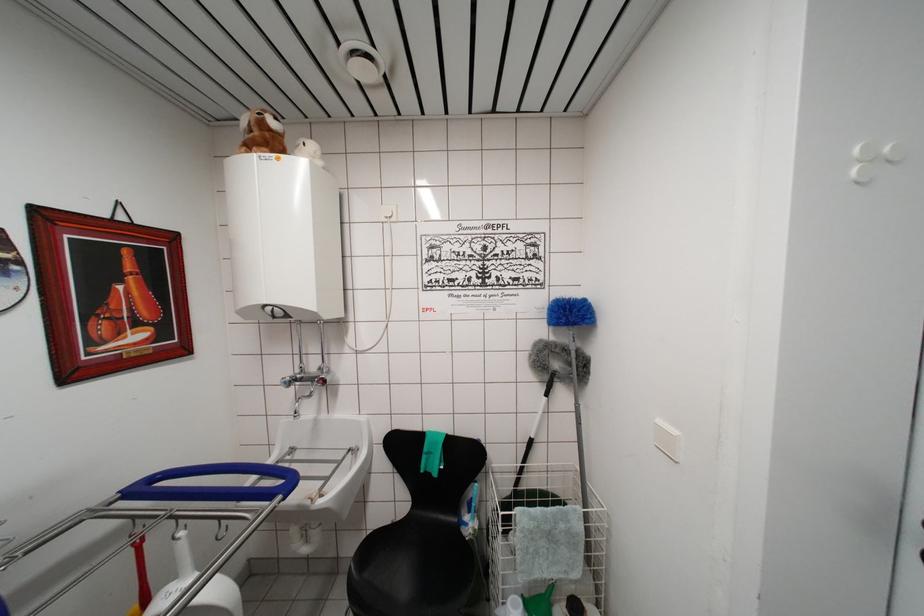
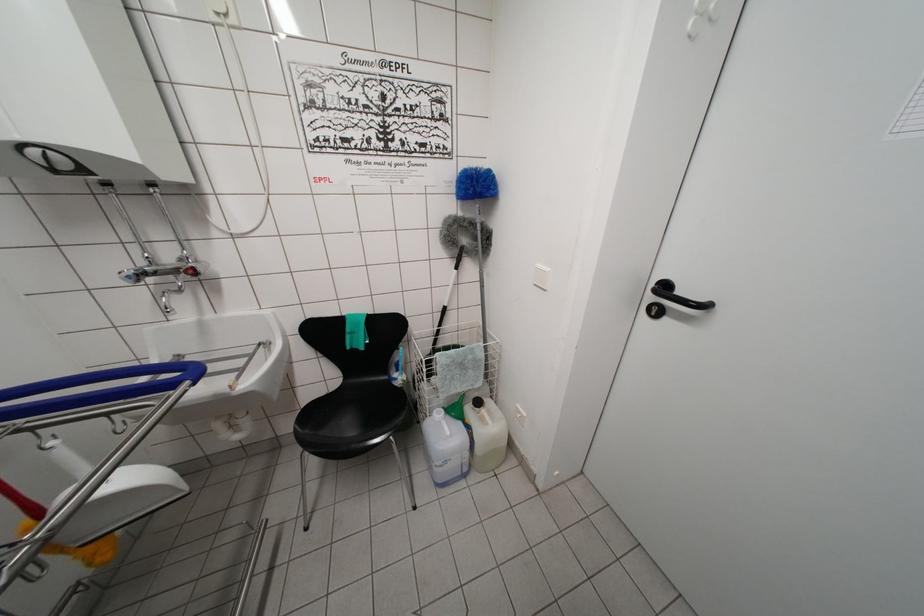
First-person continuous shooting, in which direction is the camera rotating?

The camera rotated toward right-down.